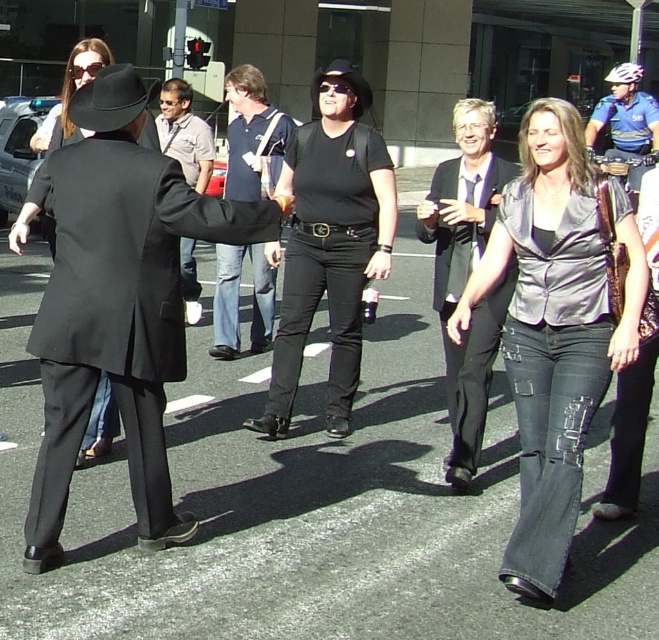
Question: Which object appears closest to the camera in this image?

Choices:
 (A) dark blue shirt at center
 (B) black matte shirt at center
 (C) metallic gray shirt at center

Answer: (C)

Question: Which point is farther from the camera taking this photo?

Choices:
 (A) (65, 81)
 (B) (386, 268)
 (C) (266, 296)

Answer: (A)

Question: Which point is farther from the camera taking this photo?

Choices:
 (A) (100, 102)
 (B) (272, 186)
 (C) (320, 248)

Answer: (B)

Question: Is dark blue shirt at center bigger than black felt fedora at center?

Choices:
 (A) yes
 (B) no

Answer: (B)

Question: Is matte black suit at left to the left of black matte shirt at center from the viewer's perspective?

Choices:
 (A) yes
 (B) no

Answer: (A)

Question: Is metallic gray shirt at center below dark blue shirt at center?

Choices:
 (A) yes
 (B) no

Answer: (A)